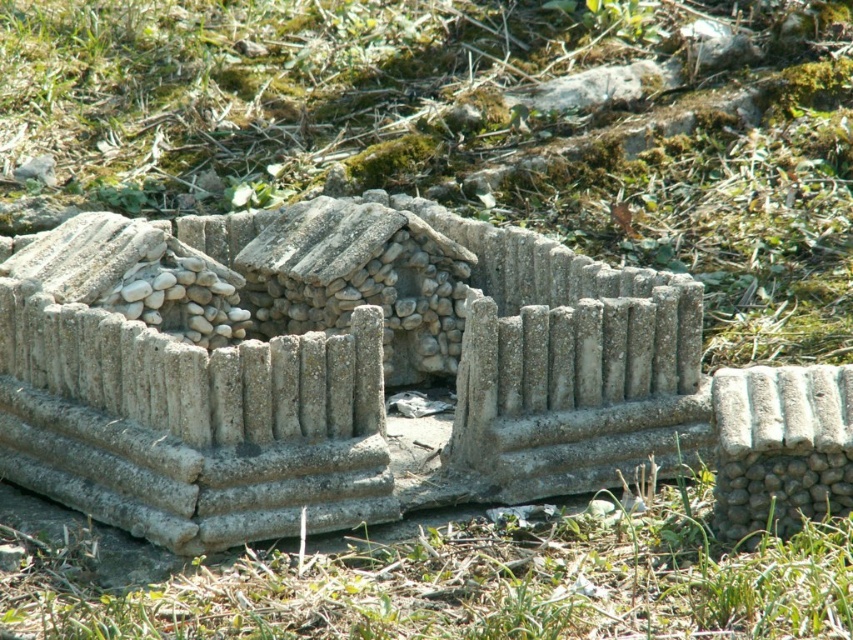
You are a gardener who wants to plant a row of flowers between the green grass at center and the gray concrete fence at center. The flowers require a minimum of 5 meters of space between them and the fence. Based on the scene, will there be enough space for the flowers?

The green grass at center is 8.78 meters from the gray concrete fence at center. Since the flowers require a minimum of 5 meters of space between them and the fence, there is sufficient space as 8.78 meters exceeds the required 5 meters.

You are a small toy dog that is 1 foot tall. You want to jump over the gray concrete fence at center from the green grass at lower center. Can you do it?

The distance between the gray concrete fence at center and green grass at lower center is 3.74 feet. Since the toy dog is only 1 foot tall, it cannot jump over the fence as the distance is too far.

You are a small toy robot that is 5 cm tall. You are standing on the green grass at lower center and want to see what is behind the gray concrete fence at center. Can you see over the top of the fence from your current position?

The gray concrete fence at center is taller than the green grass at lower center. Since the robot is only 5 cm tall and the fence is higher than the grass, it is unlikely the robot can see over the fence from its current position on the green grass at lower center.